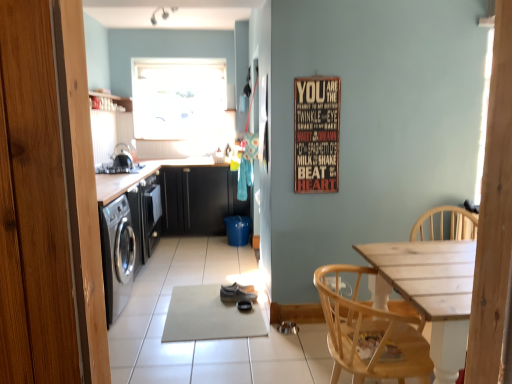
Locate an element on the screen. Image resolution: width=512 pixels, height=384 pixels. vacant space situated above gray fabric ironing board at center (from a real-world perspective) is located at coordinates (231, 296).